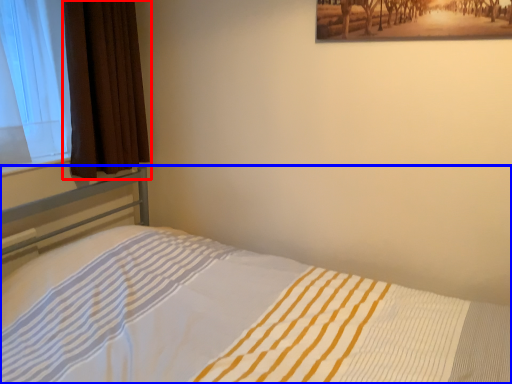
Question: Which object appears farthest to the camera in this image, curtain (highlighted by a red box) or bed (highlighted by a blue box)?

Choices:
 (A) curtain
 (B) bed

Answer: (A)